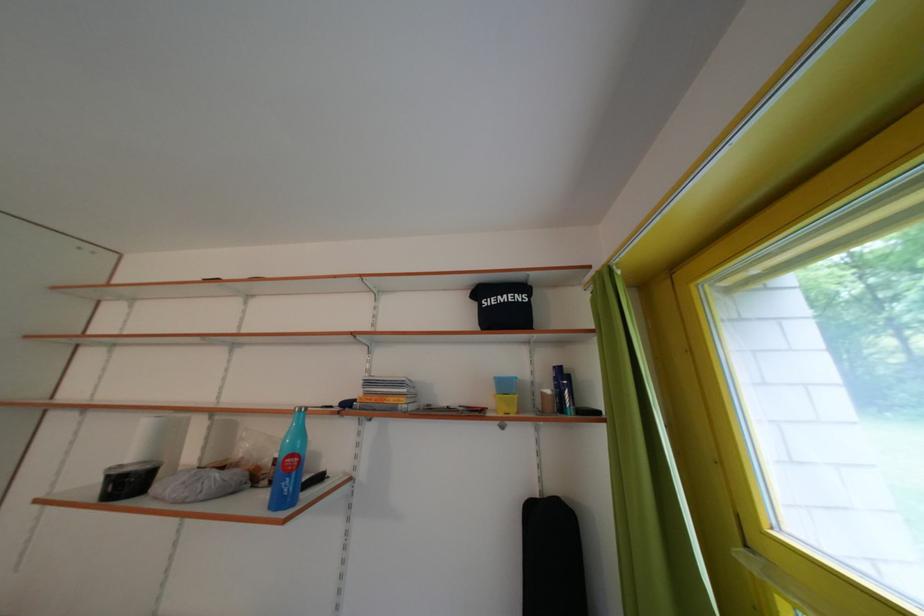
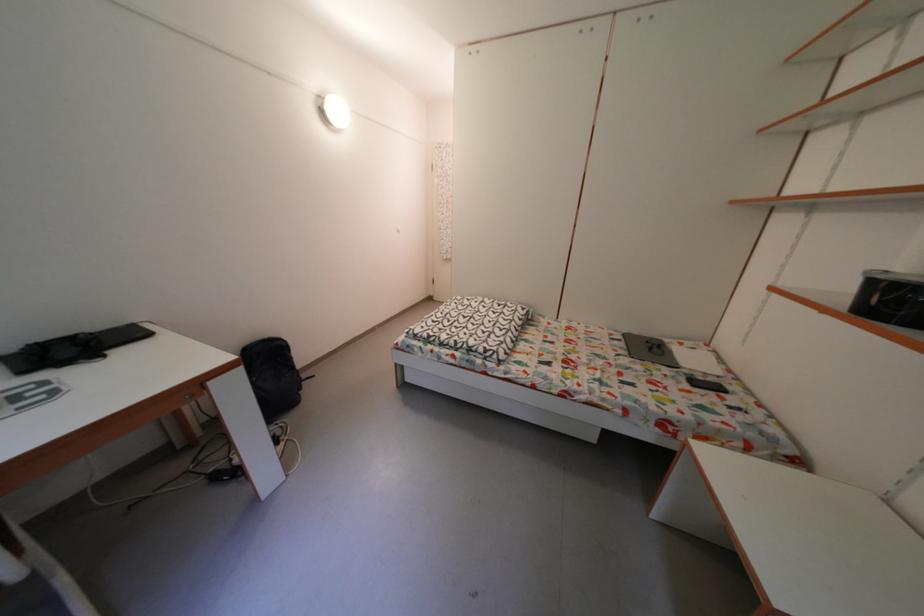
The first image is from the beginning of the video and the second image is from the end. How did the camera likely rotate when shooting the video?

The camera's rotation is toward left-down.